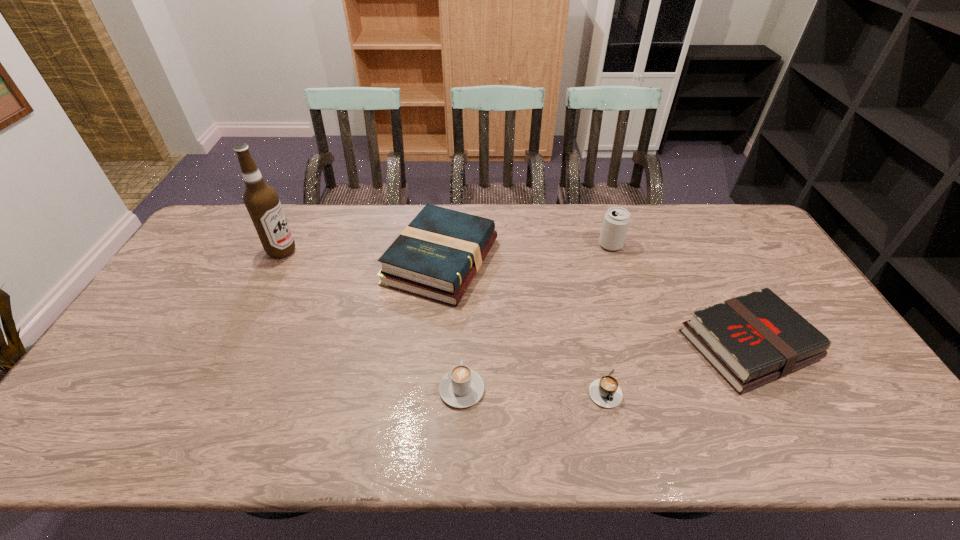
Locate an element on the screen. vacant space that satisfies the following two spatial constraints: 1. on the label of the tallest object; 2. on the left side of the left hardback book is located at coordinates (277, 261).

The width and height of the screenshot is (960, 540). I want to click on free spot that satisfies the following two spatial constraints: 1. on the label of the tallest object; 2. on the back side of the right hardback book, so click(235, 345).

At what (x,y) coordinates should I click in order to perform the action: click on vacant region that satisfies the following two spatial constraints: 1. on the label of the leftmost object; 2. on the back side of the fourth shortest object. Please return your answer as a coordinate pair (x, y). The width and height of the screenshot is (960, 540). Looking at the image, I should click on (277, 261).

At what (x,y) coordinates should I click in order to perform the action: click on vacant region that satisfies the following two spatial constraints: 1. on the label of the leftmost object; 2. on the left side of the right hardback book. Please return your answer as a coordinate pair (x, y). The image size is (960, 540). Looking at the image, I should click on (235, 345).

Image resolution: width=960 pixels, height=540 pixels. Find the location of `free space in the image that satisfies the following two spatial constraints: 1. on the back side of the left hardback book; 2. on the right side of the fifth shortest object`. free space in the image that satisfies the following two spatial constraints: 1. on the back side of the left hardback book; 2. on the right side of the fifth shortest object is located at coordinates (443, 245).